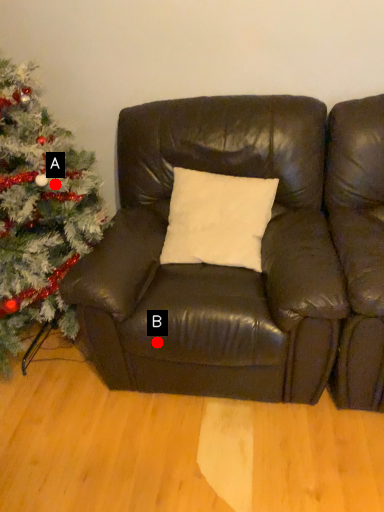
Question: Two points are circled on the image, labeled by A and B beside each circle. Which point appears closest to the camera in this image?

Choices:
 (A) A is closer
 (B) B is closer

Answer: (B)